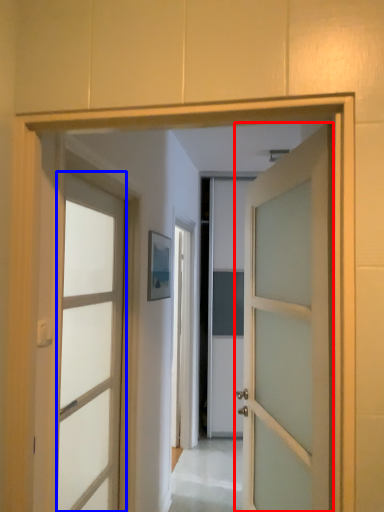
Question: Which object is closer to the camera taking this photo, door (highlighted by a red box) or door (highlighted by a blue box)?

Choices:
 (A) door
 (B) door

Answer: (A)